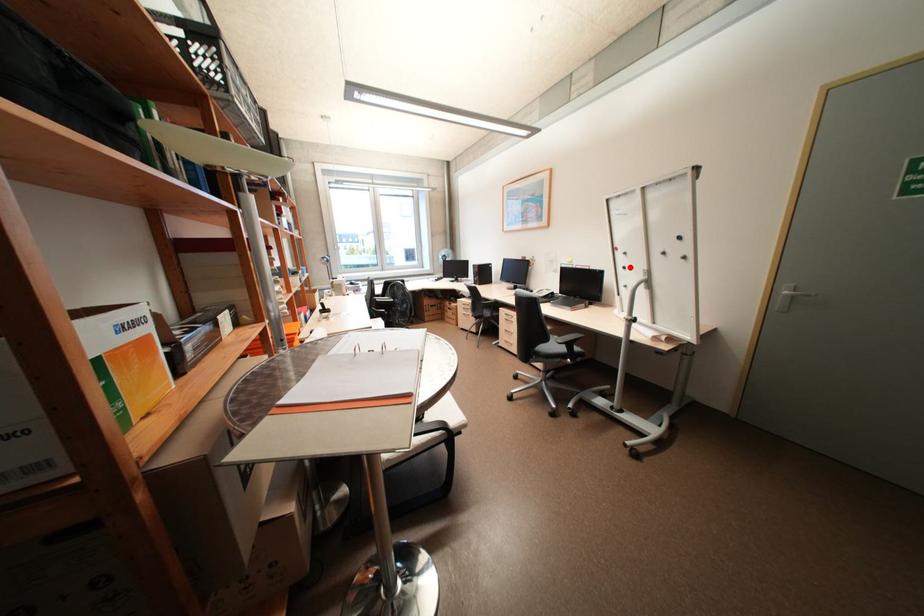
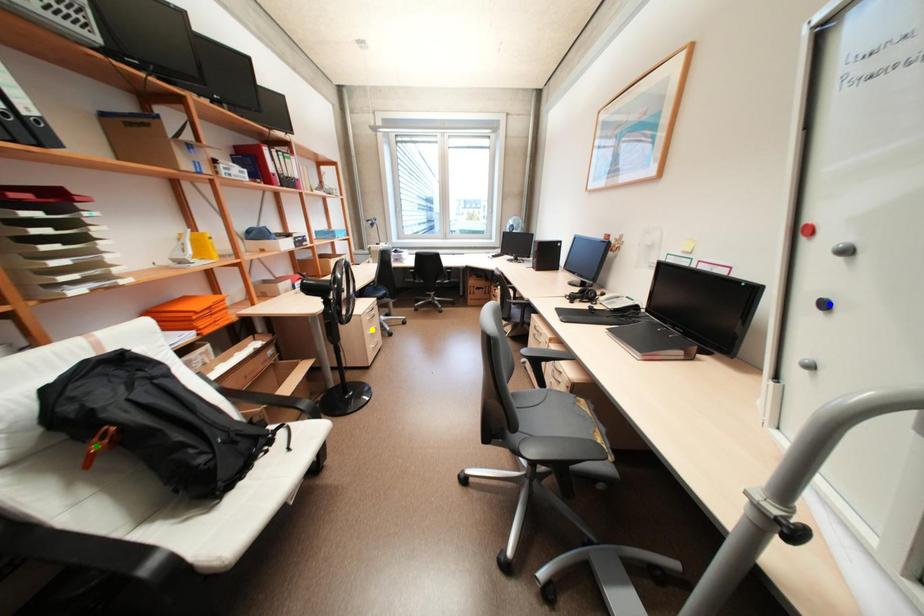
Question: I am providing you with two images of the same scene from different viewpoints. A red point is marked on the first image. You are given multiple points on the second image. Which mark in image 2 goes with the point in image 1?

Choices:
 (A) yellow point
 (B) blue point
 (C) green point

Answer: (B)